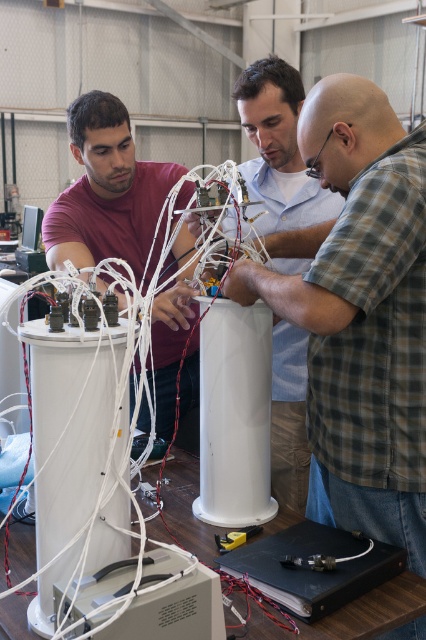
Is matte white cylinder at center taller than white plastic computer tower at lower center?

Indeed, matte white cylinder at center has a greater height compared to white plastic computer tower at lower center.

This screenshot has height=640, width=426. What do you see at coordinates (282, 166) in the screenshot?
I see `matte white cylinder at center` at bounding box center [282, 166].

What do you see at coordinates (282, 166) in the screenshot? I see `matte white cylinder at center` at bounding box center [282, 166].

At what (x,y) coordinates should I click in order to perform the action: click on matte white cylinder at center. Please return your answer as a coordinate pair (x, y). Looking at the image, I should click on (282, 166).

Who is positioned more to the left, matte red shirt at center or black plastic box at lower center?

matte red shirt at center is more to the left.

Can you confirm if matte red shirt at center is positioned below black plastic box at lower center?

No, matte red shirt at center is not below black plastic box at lower center.

Which is in front, point (100, 140) or point (339, 589)?

Point (339, 589) is more forward.

Image resolution: width=426 pixels, height=640 pixels. I want to click on matte red shirt at center, so click(x=106, y=189).

Image resolution: width=426 pixels, height=640 pixels. Describe the element at coordinates (282, 166) in the screenshot. I see `matte white cylinder at center` at that location.

Does matte white cylinder at center appear on the left side of black plastic box at lower center?

Correct, you'll find matte white cylinder at center to the left of black plastic box at lower center.

Does point (282, 97) lie behind point (256, 566)?

That is True.

Identify the location of matte white cylinder at center. (282, 166).